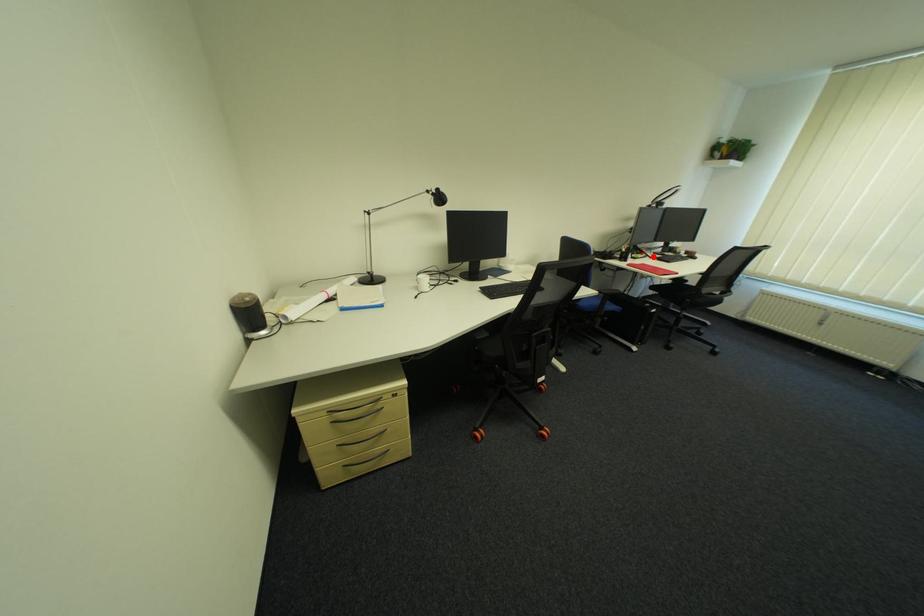
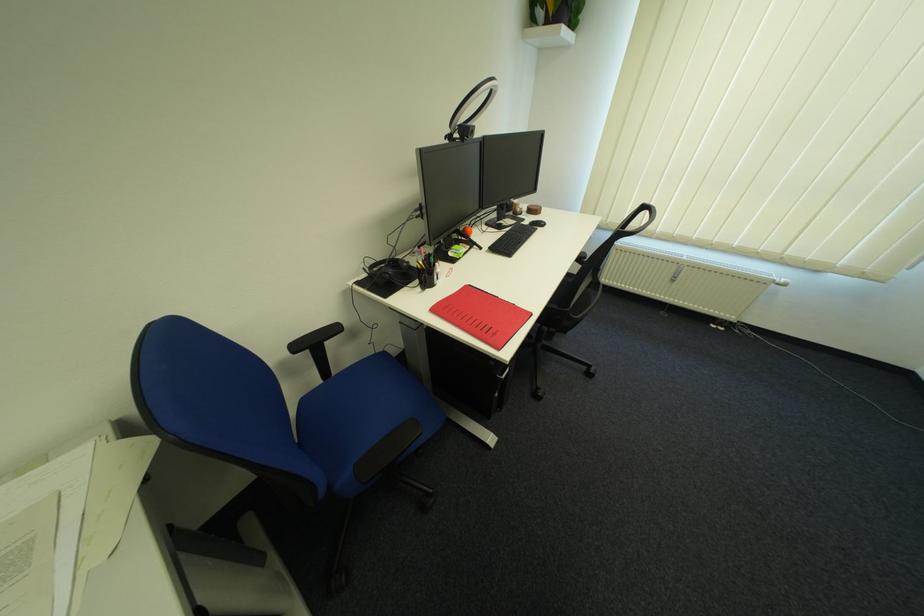
In the second image, find the point that corresponds to the highlighted location in the first image.

(479, 248)